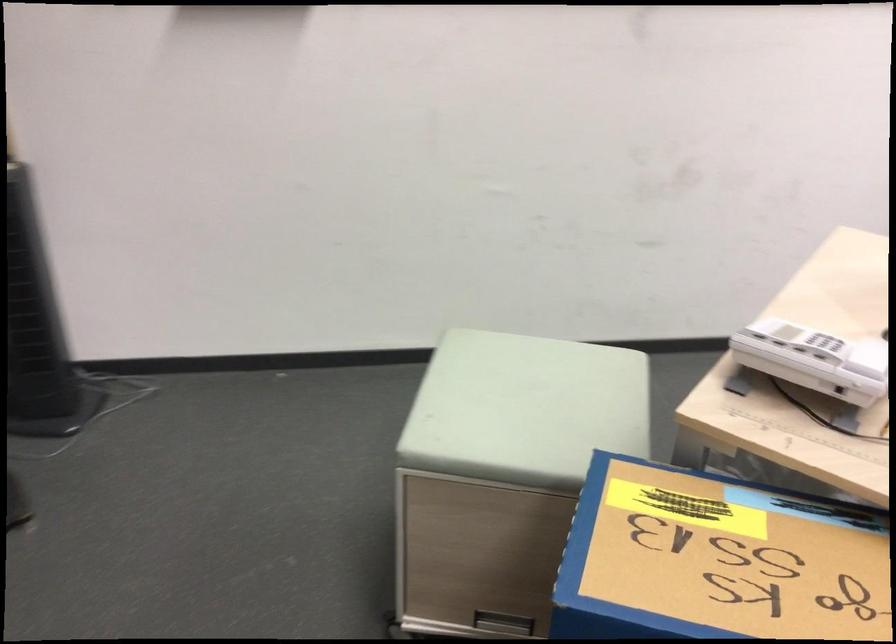
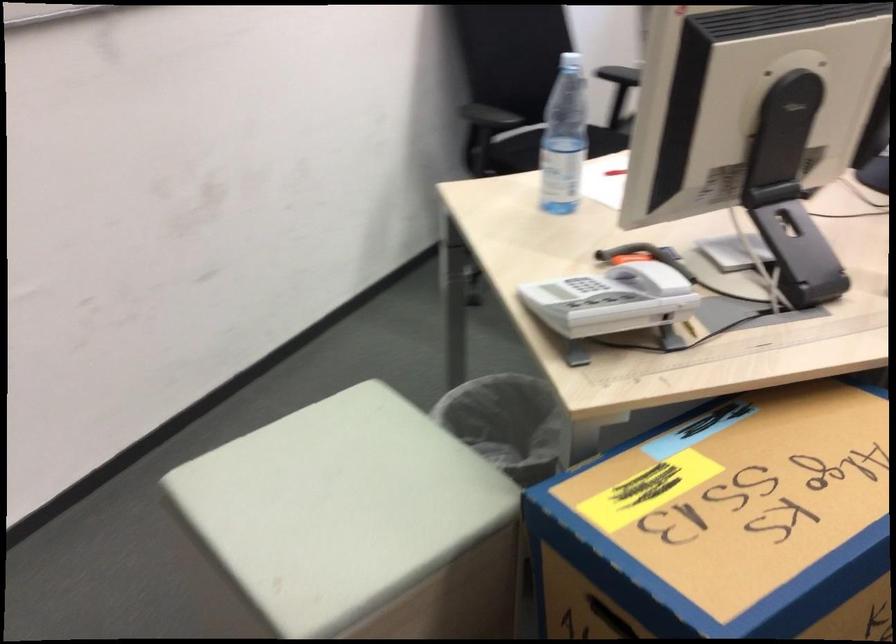
Where in the second image is the point corresponding to the point at 521,401 from the first image?

(339, 502)